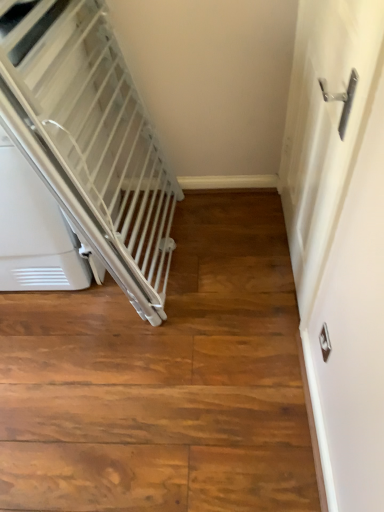
Question: Is white metallic door handle at right bigger or smaller than white plastic escalator at left?

Choices:
 (A) small
 (B) big

Answer: (A)

Question: Considering the positions of white metallic door handle at right and white plastic escalator at left in the image, is white metallic door handle at right taller or shorter than white plastic escalator at left?

Choices:
 (A) tall
 (B) short

Answer: (A)

Question: From a real-world perspective, is white metallic door handle at right positioned above or below white plastic escalator at left?

Choices:
 (A) below
 (B) above

Answer: (B)

Question: Looking at the image, does white plastic escalator at left seem bigger or smaller compared to white metallic door handle at right?

Choices:
 (A) small
 (B) big

Answer: (B)

Question: Is white plastic escalator at left to the left or to the right of white metallic door handle at right in the image?

Choices:
 (A) left
 (B) right

Answer: (A)

Question: From the image's perspective, is white plastic escalator at left located above or below white metallic door handle at right?

Choices:
 (A) above
 (B) below

Answer: (A)

Question: Considering their positions, is white plastic escalator at left located in front of or behind white metallic door handle at right?

Choices:
 (A) behind
 (B) front

Answer: (A)